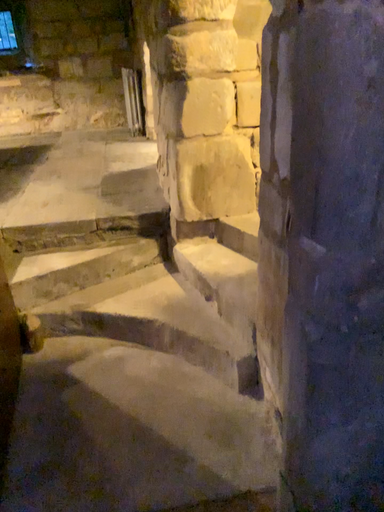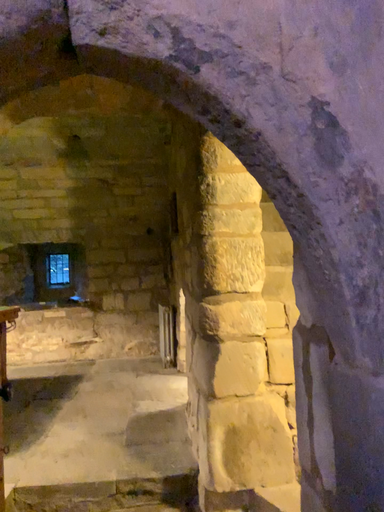
Question: Which way did the camera rotate in the video?

Choices:
 (A) rotated upward
 (B) rotated downward

Answer: (A)